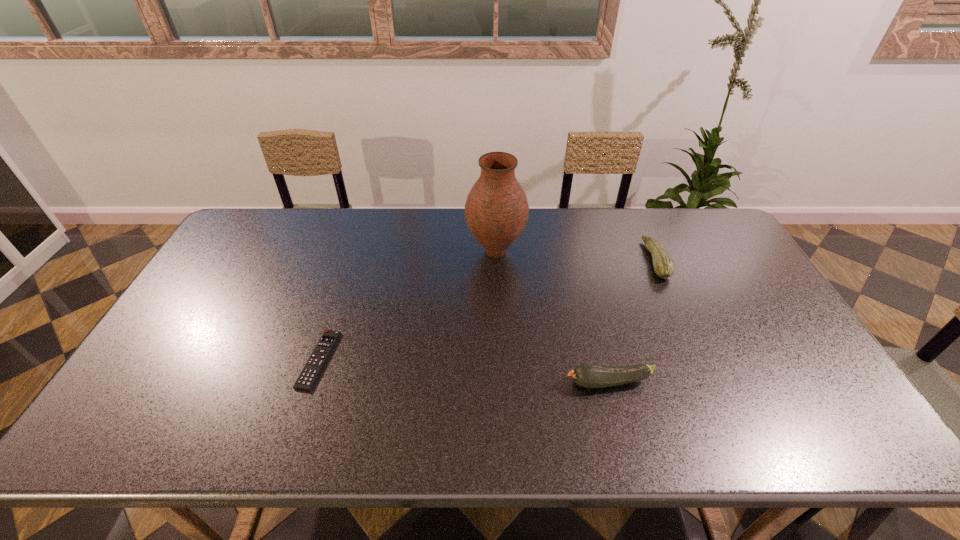
Where is `vacant point at the left edge`? vacant point at the left edge is located at coordinates (244, 285).

You are a GUI agent. You are given a task and a screenshot of the screen. Output one action in this format:
    pyautogui.click(x=<x>, y=<y>)
    Task: Click on the vacant space at the right edge of the desktop
    
    Given the screenshot: What is the action you would take?
    pyautogui.click(x=732, y=259)

The width and height of the screenshot is (960, 540). In the image, there is a desktop. What are the coordinates of `free space at the far left corner` in the screenshot? It's located at (285, 210).

Find the location of a particular element. free space between the shortest object and the vase is located at coordinates coord(407,306).

Where is `unoccupied area between the third object from right to left and the rightmost object`? The width and height of the screenshot is (960, 540). unoccupied area between the third object from right to left and the rightmost object is located at coordinates (576, 256).

What are the coordinates of `empty location between the vase and the farther zucchini` in the screenshot? It's located at (576, 256).

Identify the location of unoccupied area between the tallest object and the left zucchini. This screenshot has height=540, width=960. (552, 317).

Where is `vacant space that's between the farther zucchini and the nearer zucchini`? vacant space that's between the farther zucchini and the nearer zucchini is located at coordinates (633, 321).

In order to click on vacant area that lies between the leftmost object and the vase in this screenshot , I will do `click(407, 306)`.

In order to click on unoccupied area between the tallest object and the farther zucchini in this screenshot , I will do `click(576, 256)`.